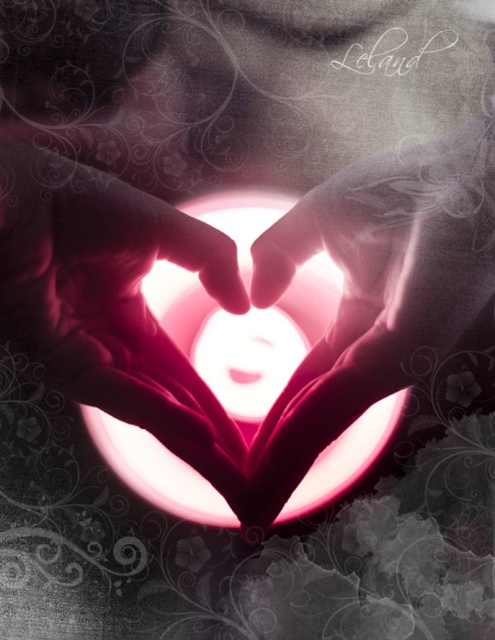
You are an artist trying to replicate the scene. The canvas is 1 meter wide. If you want to place the smooth skin hand at center exactly where it is in the image, what coordinate on the canvas should you aim for?

The smooth skin hand at center is located at point (106, 291), so you should aim for the coordinate (106, 291) on the canvas which is 1 meter wide.

You are taking a photo of the heart shape formed by two hands. You want to focus on the point closer to the camera between point [235,268] and point [247,205]. Which point should you focus on?

Point [235,268] is further to the camera than point [247,205], so you should focus on point [235,268].

You are a photographer standing in front of the smooth skin hand at center. You want to take a closeup photo of it. If your camera can focus on objects within 3 feet, will you be able to take the photo without moving closer?

The smooth skin hand at center and viewer are 3.88 feet apart from each other. Since the camera can focus within 3 feet, the distance is too far. Move closer to within 3 feet to take the photo.